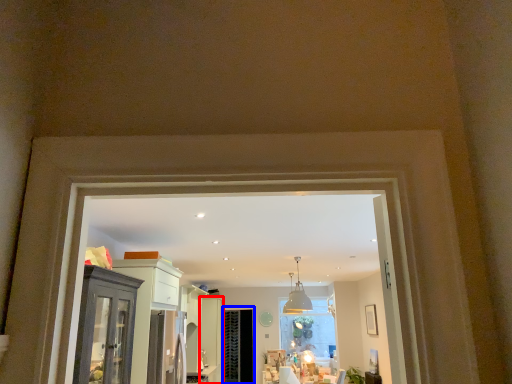
Question: Which object appears farthest to the camera in this image, door (highlighted by a red box) or screen door (highlighted by a blue box)?

Choices:
 (A) door
 (B) screen door

Answer: (B)